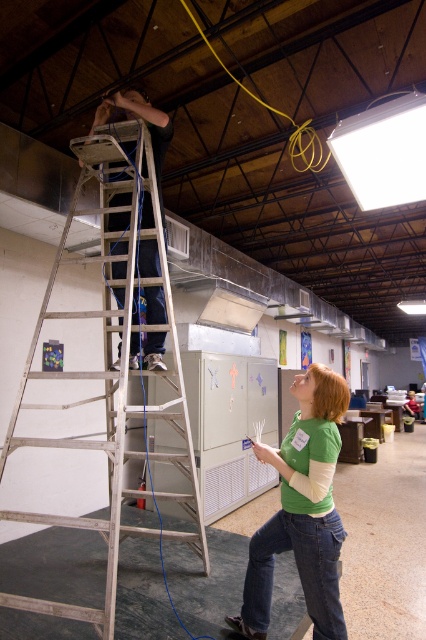
You are standing in the hall and need to reach a high shelf that is 3 meters tall. You see a silver metallic ladder at upper left and a green matte shirt at lower center. Which object can help you safely reach the shelf?

The silver metallic ladder at upper left is much taller than the green matte shirt at lower center, so the ladder can help you safely reach the 3 meters tall shelf.

You are a visitor in the hall and see the green matte shirt at lower center and the matte black ladder at upper left. Which object is closer to you?

The green matte shirt at lower center is closer to you because it is in front of the matte black ladder at upper left.

Please look at the silver metallic ladder at upper left. What are the coordinates of it?

The silver metallic ladder at upper left is located at point (111, 369).